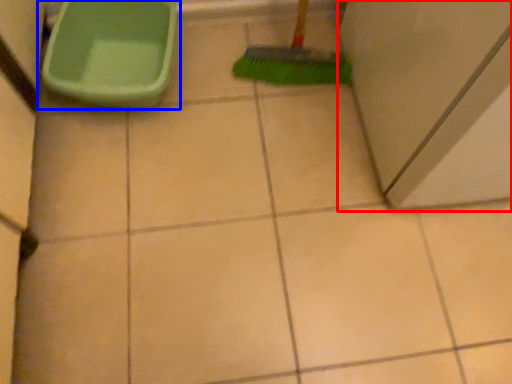
Question: Which point is further to the camera, screen door (highlighted by a red box) or toilet (highlighted by a blue box)?

Choices:
 (A) screen door
 (B) toilet

Answer: (B)